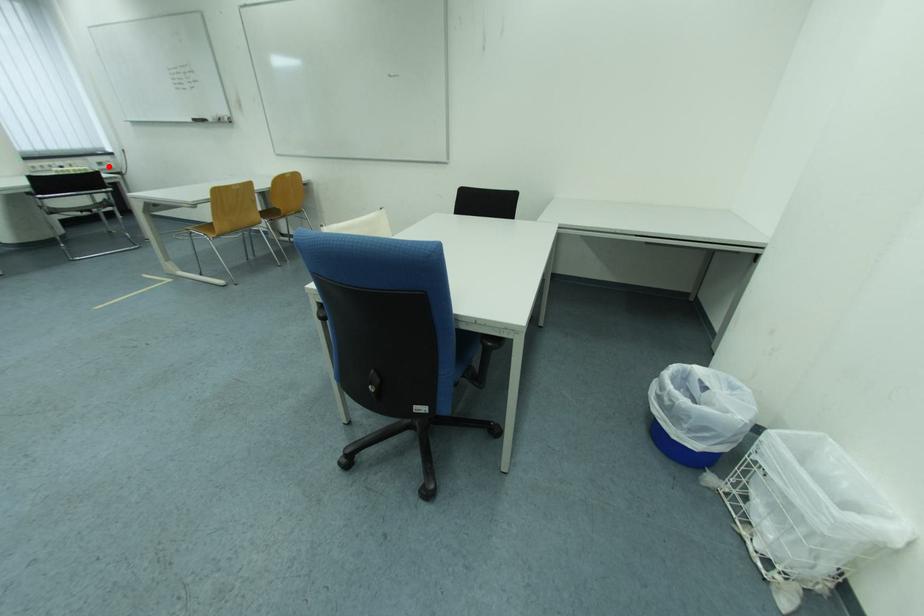
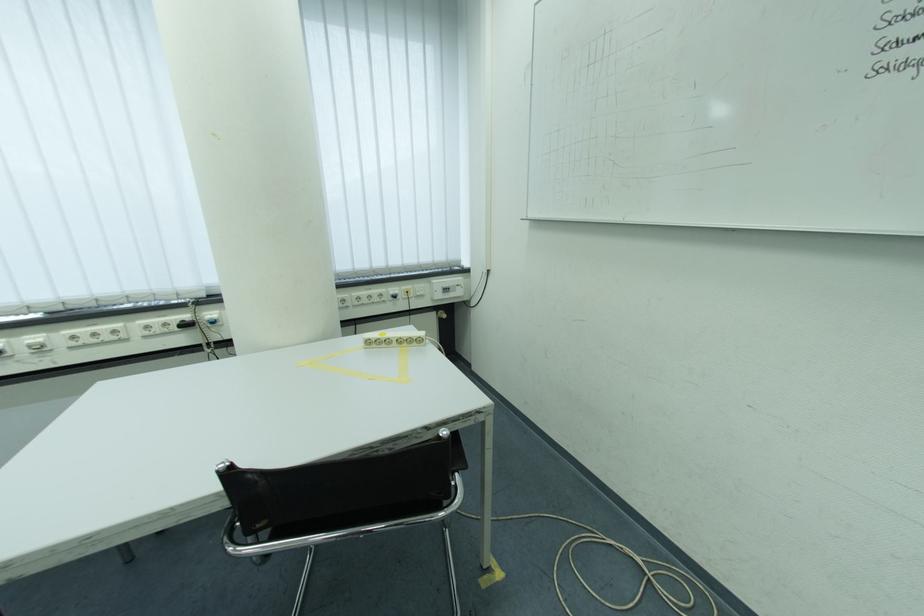
Question: A red point is marked in image1. In image2, is the corresponding 3D point closer to the camera or farther? Reply with the corresponding letter.

Choices:
 (A) The corresponding 3D point is closer.
 (B) The corresponding 3D point is farther.

Answer: (A)